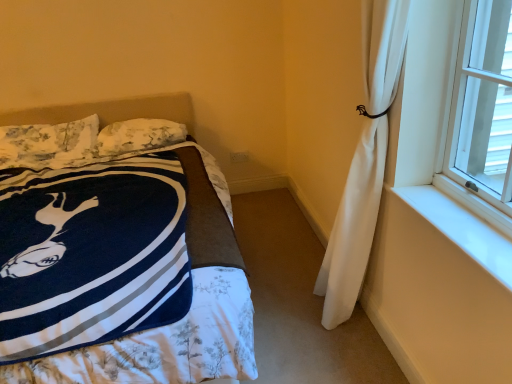
Question: From the image's perspective, is floral fabric pillow at upper left, arranged as the 1th pillow when viewed from the left, located above or below white smooth window sill at right?

Choices:
 (A) below
 (B) above

Answer: (B)

Question: Is floral fabric pillow at upper left, arranged as the 1th pillow when viewed from the left, wider or thinner than white smooth window sill at right?

Choices:
 (A) thin
 (B) wide

Answer: (B)

Question: Estimate the real-world distances between objects in this image. Which object is closer to the white smooth window sill at right?

Choices:
 (A) floral fabric pillow at upper left, which is the second pillow from right to left
 (B) navy blue fleece blanket at left
 (C) fluffy white pillow at upper left, the first pillow when ordered from right to left

Answer: (C)

Question: Estimate the real-world distances between objects in this image. Which object is farther from the white smooth window sill at right?

Choices:
 (A) fluffy white pillow at upper left, the first pillow when ordered from right to left
 (B) navy blue fleece blanket at left
 (C) floral fabric pillow at upper left, which is the second pillow from right to left

Answer: (C)